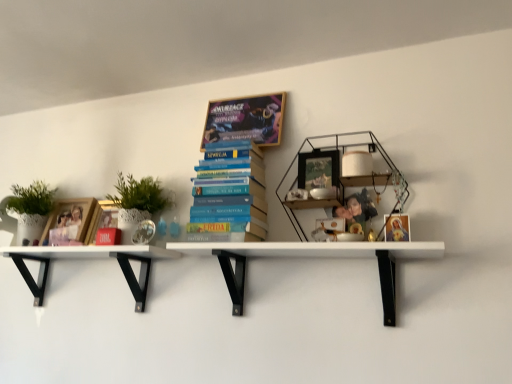
Question: From a real-world perspective, is blue hardcover books at center, positioned as the second book in top-to-bottom order, on matte gold frame at upper right, marked as the 2th book cover in a back-to-front arrangement?

Choices:
 (A) no
 (B) yes

Answer: (B)

Question: Does blue hardcover books at center, positioned as the second book in top-to-bottom order, turn towards matte gold frame at upper right, the 2th book cover when ordered from left to right?

Choices:
 (A) yes
 (B) no

Answer: (B)

Question: From the image's perspective, is blue hardcover books at center, positioned as the second book in top-to-bottom order, under matte gold frame at upper right, which appears as the 1th book cover when viewed from the front?

Choices:
 (A) no
 (B) yes

Answer: (A)

Question: Does blue hardcover books at center, the 1th book in the bottom-to-top sequence, come behind matte gold frame at upper right, marked as the 2th book cover in a back-to-front arrangement?

Choices:
 (A) yes
 (B) no

Answer: (A)

Question: Does blue hardcover books at center, the 1th book in the bottom-to-top sequence, have a lesser width compared to matte gold frame at upper right, which appears as the 1th book cover when viewed from the front?

Choices:
 (A) yes
 (B) no

Answer: (B)

Question: Is blue hardcover books at center, positioned as the second book in top-to-bottom order, not inside matte gold frame at upper right, which appears as the 1th book cover when viewed from the front?

Choices:
 (A) yes
 (B) no

Answer: (A)

Question: Is woodenmaterial/texturebookcase at upper right shorter than white matte shelf at lower left, which is the second shelf in right-to-left order?

Choices:
 (A) yes
 (B) no

Answer: (B)

Question: Considering the relative sizes of woodenmaterial/texturebookcase at upper right and white matte shelf at lower left, acting as the 1th shelf starting from the left, in the image provided, is woodenmaterial/texturebookcase at upper right wider than white matte shelf at lower left, acting as the 1th shelf starting from the left,?

Choices:
 (A) yes
 (B) no

Answer: (B)

Question: From the image's perspective, is woodenmaterial/texturebookcase at upper right under white matte shelf at lower left, which is the second shelf in right-to-left order?

Choices:
 (A) yes
 (B) no

Answer: (B)

Question: Can you confirm if woodenmaterial/texturebookcase at upper right is smaller than white matte shelf at lower left, which is the second shelf in right-to-left order?

Choices:
 (A) yes
 (B) no

Answer: (A)

Question: From a real-world perspective, is woodenmaterial/texturebookcase at upper right below white matte shelf at lower left, which is the second shelf in right-to-left order?

Choices:
 (A) no
 (B) yes

Answer: (A)

Question: Is white matte shelf at lower left, acting as the 1th shelf starting from the left, located within woodenmaterial/texturebookcase at upper right?

Choices:
 (A) no
 (B) yes

Answer: (A)

Question: From a real-world perspective, is matte black picture frame at center positioned over white matte shelf at lower left, acting as the 1th shelf starting from the left, based on gravity?

Choices:
 (A) yes
 (B) no

Answer: (A)